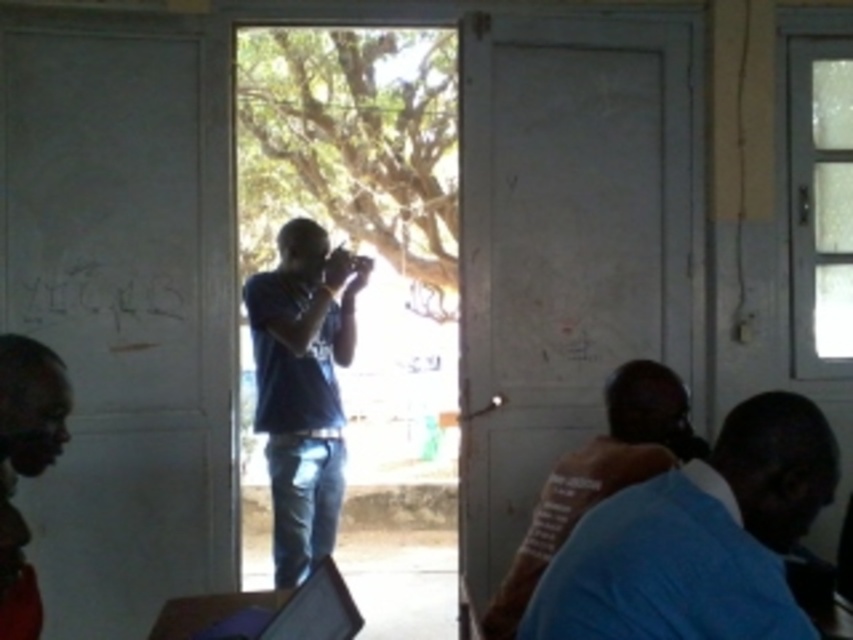
Question: Estimate the real-world distances between objects in this image. Which object is closer to the blue cotton shirt at lower right?

Choices:
 (A) matte black laptop at lower left
 (B) blue denim jeans at center

Answer: (A)

Question: Which object is positioned closest to the dark red shirt at lower left?

Choices:
 (A) blue denim jeans at center
 (B) matte black laptop at lower left

Answer: (B)

Question: Does blue denim jeans at center have a greater width compared to matte black laptop at lower left?

Choices:
 (A) yes
 (B) no

Answer: (B)

Question: Where is blue cotton shirt at lower right located in relation to blue denim jeans at center in the image?

Choices:
 (A) right
 (B) left

Answer: (A)

Question: Can you confirm if blue cotton shirt at lower right is positioned below blue denim jeans at center?

Choices:
 (A) no
 (B) yes

Answer: (B)

Question: Which object appears closest to the camera in this image?

Choices:
 (A) blue denim jeans at center
 (B) blue cotton shirt at lower right
 (C) matte black laptop at lower left
 (D) dark red shirt at lower left

Answer: (B)